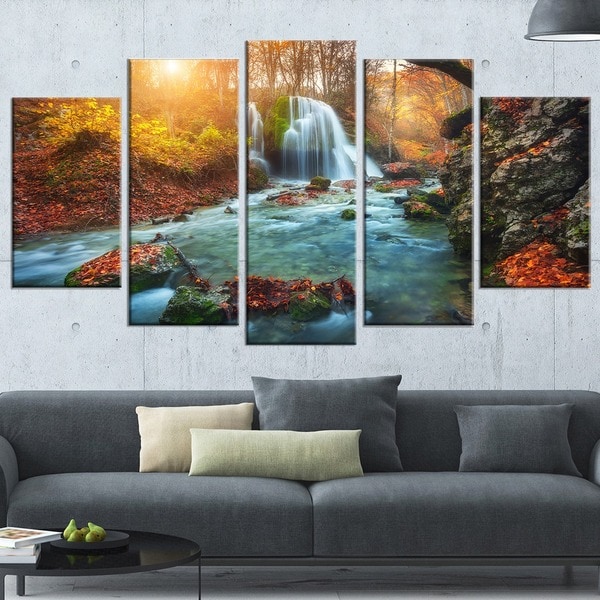
Locate an element on the screen. The image size is (600, 600). wall art is located at coordinates (65, 198), (176, 192), (293, 183), (387, 190), (534, 197).